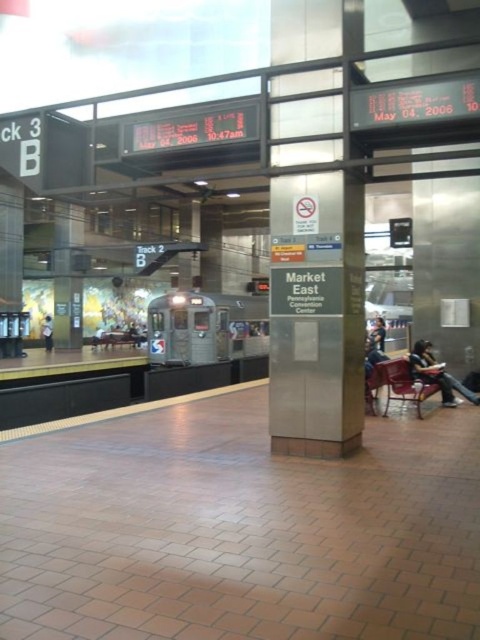
Question: Which of the following is the farthest from the observer?

Choices:
 (A) (298, 33)
 (B) (372, 330)

Answer: (B)

Question: Can you confirm if satin silver sign at center is wider than dark blue jeans at center?

Choices:
 (A) no
 (B) yes

Answer: (A)

Question: Is satin silver sign at center to the right of light blue shirt at left from the viewer's perspective?

Choices:
 (A) yes
 (B) no

Answer: (A)

Question: Which object is closer to the camera taking this photo?

Choices:
 (A) dark blue jeans at lower right
 (B) satin silver sign at center
 (C) silver metallic train at center
 (D) dark blue jeans at center

Answer: (B)

Question: Which point is closer to the camera?

Choices:
 (A) (225, 307)
 (B) (271, 221)

Answer: (B)

Question: Is dark blue jeans at center positioned before light blue shirt at left?

Choices:
 (A) yes
 (B) no

Answer: (A)